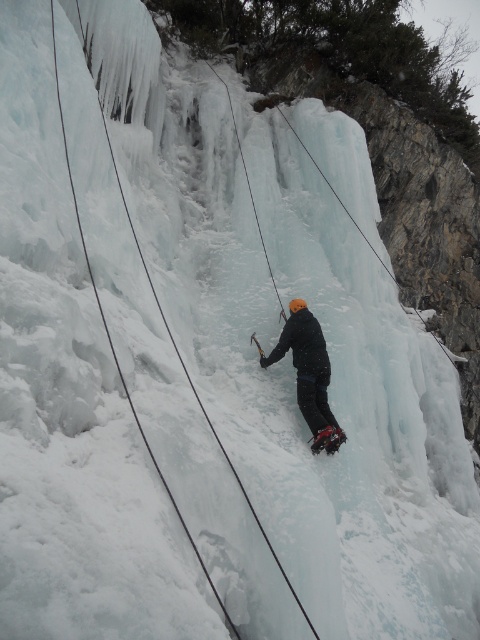
You are an ice climber trying to reach the top of the frozen waterfall. You notice the matte black jacket at center and the black nylon rope at center. Which object is closer to the bottom of the waterfall?

The matte black jacket at center is positioned under the black nylon rope at center, so it is closer to the bottom of the waterfall.

You are an ice climber preparing to secure your equipment. You have a matte black jacket at center and a black nylon rope at center. Which item is shorter?

The matte black jacket at center is shorter than the black nylon rope at center.

You are an ice climber preparing to ascend the frozen waterfall. You notice the matte black jacket at center and the black nylon rope at center. Which object takes up less space in the image?

The matte black jacket at center is smaller than the black nylon rope at center, so it takes up less space in the image.